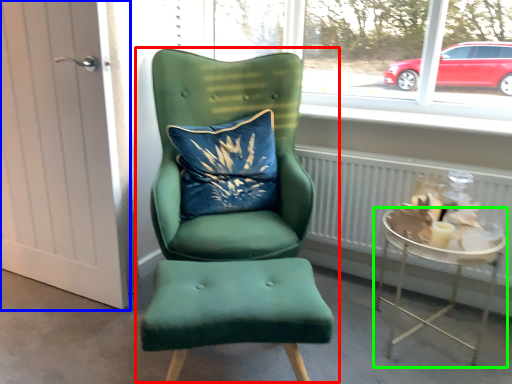
Question: Which is nearer to the chair (highlighted by a red box)? door (highlighted by a blue box) or table (highlighted by a green box).

Choices:
 (A) door
 (B) table

Answer: (A)